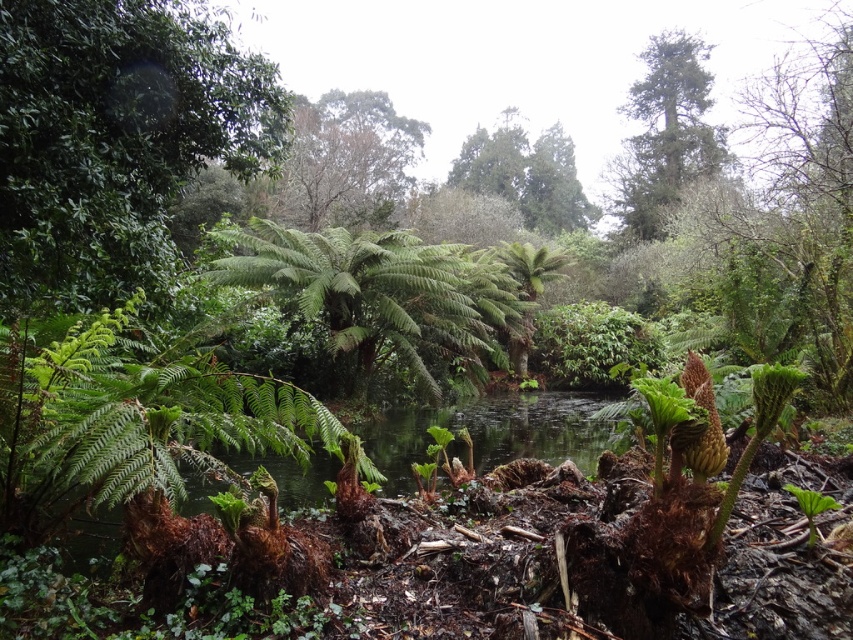
Between point (608, 205) and point (550, 170), which one is positioned behind?

Point (550, 170)

Does green textured tree at upper right appear on the left side of green leafy tree at upper center?

In fact, green textured tree at upper right is to the right of green leafy tree at upper center.

This screenshot has width=853, height=640. I want to click on green textured tree at upper right, so click(x=665, y=132).

Is green leafy fern at center below green textured tree at upper right?

Yes.

Is point (132, 422) positioned behind point (694, 120)?

No, (132, 422) is closer to viewer.

Is point (85, 371) farther from viewer compared to point (665, 188)?

No, (85, 371) is in front of (665, 188).

Identify the location of green leafy fern at center. This screenshot has width=853, height=640. (132, 417).

Does green glossy leafy tree at upper left have a larger size compared to green leafy tree at upper center?

No.

Does point (167, 90) lie in front of point (448, 173)?

Yes, point (167, 90) is closer to viewer.

At what (x,y) coordinates should I click in order to perform the action: click on green glossy leafy tree at upper left. Please return your answer as a coordinate pair (x, y). The height and width of the screenshot is (640, 853). Looking at the image, I should click on (115, 138).